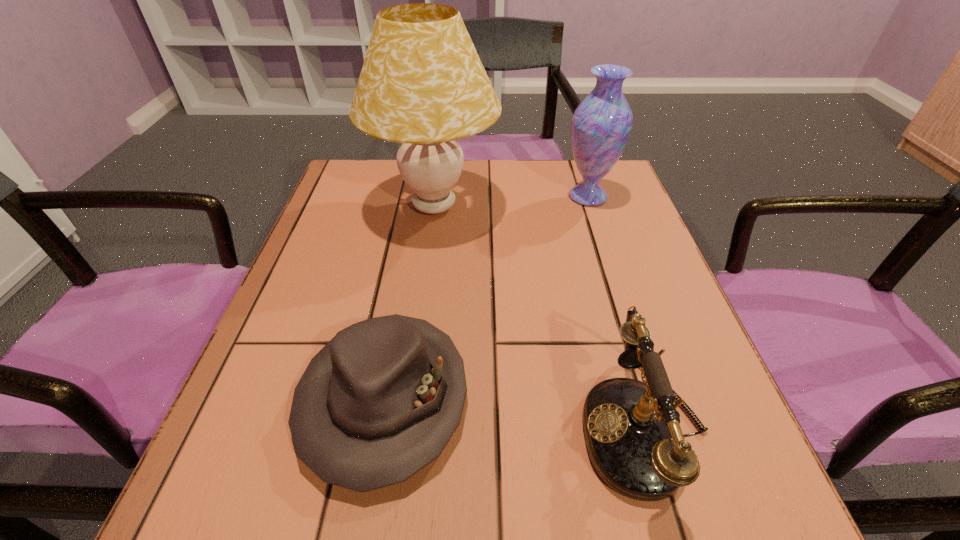
You are a GUI agent. You are given a task and a screenshot of the screen. Output one action in this format:
    pyautogui.click(x=<x>, y=<y>)
    Task: Click on the lampshade
    
    Given the screenshot: What is the action you would take?
    pyautogui.click(x=422, y=84)

At what (x,y) coordinates should I click in order to perform the action: click on the second tallest object. Please return your answer as a coordinate pair (x, y). The height and width of the screenshot is (540, 960). Looking at the image, I should click on (601, 124).

Find the location of a particular element. telephone is located at coordinates (632, 429).

The image size is (960, 540). What are the coordinates of `hat` in the screenshot? It's located at (380, 401).

Find the location of a particular element. The height and width of the screenshot is (540, 960). vacant space situated 0.090m on the right of the lampshade is located at coordinates (536, 207).

This screenshot has height=540, width=960. In order to click on free spot located on the front of the vase in this screenshot , I will do `click(618, 289)`.

The width and height of the screenshot is (960, 540). I want to click on vacant space located on the dial of the telephone, so click(x=458, y=428).

Locate an element on the screen. The width and height of the screenshot is (960, 540). vacant area situated 0.270m on the dial of the telephone is located at coordinates (396, 428).

Where is `vacant position located on the dial of the telephone`? vacant position located on the dial of the telephone is located at coordinates [x=348, y=428].

Locate an element on the screen. This screenshot has height=540, width=960. lampshade that is at the far edge is located at coordinates (422, 84).